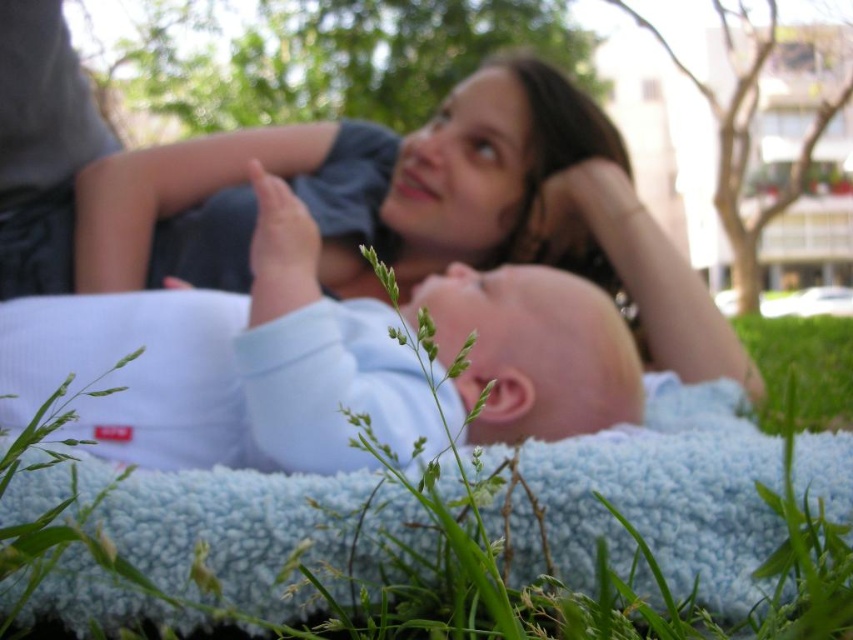
Does green fuzzy grass at lower center appear under green soft grass at lower right?

Yes.

Between point (183, 579) and point (813, 403), which one is positioned behind?

Positioned behind is point (813, 403).

This screenshot has height=640, width=853. In order to click on green fuzzy grass at lower center in this screenshot , I will do `click(666, 497)`.

Who is lower down, light blue fabric at center or green soft grass at lower right?

Positioned lower is green soft grass at lower right.

Which is more to the right, light blue fabric at center or green soft grass at lower right?

From the viewer's perspective, green soft grass at lower right appears more on the right side.

Locate an element on the screen. The height and width of the screenshot is (640, 853). light blue fabric at center is located at coordinates (225, 365).

Image resolution: width=853 pixels, height=640 pixels. I want to click on light blue fabric at center, so click(x=225, y=365).

Who is more forward, [581,324] or [161,508]?

Point [161,508]

Who is lower down, light blue fabric at center or green fuzzy grass at lower center?

green fuzzy grass at lower center is lower down.

Describe the element at coordinates (225, 365) in the screenshot. I see `light blue fabric at center` at that location.

At what (x,y) coordinates should I click in order to perform the action: click on light blue fabric at center. Please return your answer as a coordinate pair (x, y). Looking at the image, I should click on (225, 365).